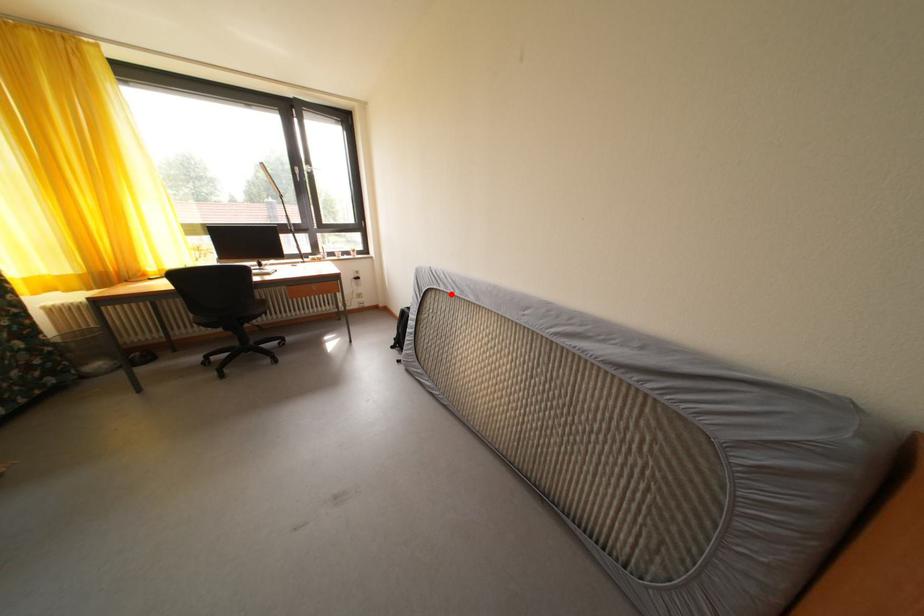
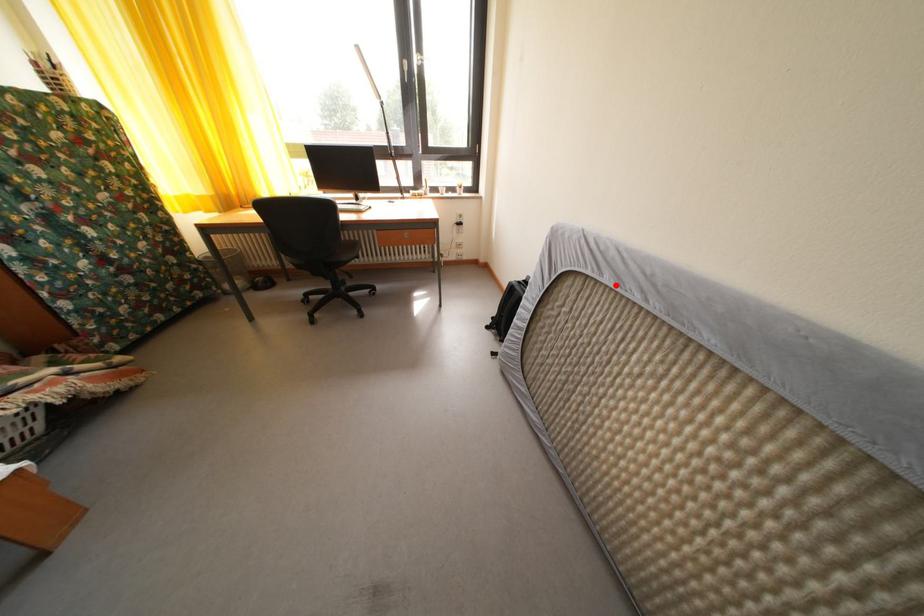
I am providing you with two images of the same scene from different viewpoints. A red point is marked on the first image and another point is marked on the second image. Do the highlighted points in image1 and image2 indicate the same real-world spot?

Yes